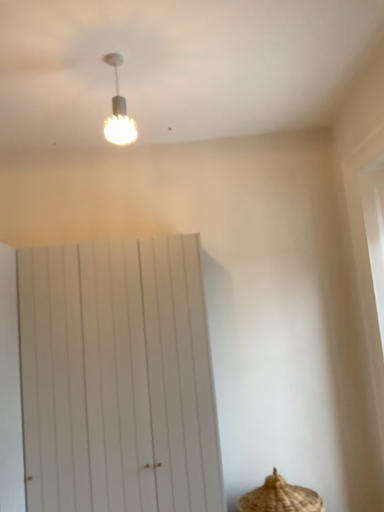
This screenshot has height=512, width=384. Find the location of `white textured bulb at upper center`. white textured bulb at upper center is located at coordinates (118, 111).

This screenshot has height=512, width=384. I want to click on brown woven basket at lower right, so click(x=280, y=497).

Find the location of `white wooden barn door at center`. white wooden barn door at center is located at coordinates (117, 378).

Locate an element on the screen. This screenshot has height=512, width=384. white textured bulb at upper center is located at coordinates (118, 111).

Looking at this image, is white wooden barn door at center with brown woven basket at lower right?

No, white wooden barn door at center is not touching brown woven basket at lower right.

The height and width of the screenshot is (512, 384). I want to click on basket below the white wooden barn door at center (from the image's perspective), so pos(280,497).

Could you tell me if white wooden barn door at center is turned towards brown woven basket at lower right?

No, white wooden barn door at center is not turned towards brown woven basket at lower right.

Considering the points (129, 125) and (181, 265), which point is in front, point (129, 125) or point (181, 265)?

The point (129, 125) is in front.

Is white textured bulb at upper center aimed at white wooden barn door at center?

No, white textured bulb at upper center is not oriented towards white wooden barn door at center.

Considering the positions of objects white textured bulb at upper center and white wooden barn door at center in the image provided, who is more to the right, white textured bulb at upper center or white wooden barn door at center?

From the viewer's perspective, white textured bulb at upper center appears more on the right side.

Is white textured bulb at upper center not within white wooden barn door at center?

Yes, white textured bulb at upper center is located beyond the bounds of white wooden barn door at center.

Can you confirm if brown woven basket at lower right is smaller than white wooden barn door at center?

Indeed, brown woven basket at lower right has a smaller size compared to white wooden barn door at center.

From the image's perspective, relative to white wooden barn door at center, is brown woven basket at lower right above or below?

brown woven basket at lower right is situated lower than white wooden barn door at center in the image.

Is brown woven basket at lower right in contact with white wooden barn door at center?

brown woven basket at lower right and white wooden barn door at center are clearly separated.

Choose the correct answer: Is brown woven basket at lower right inside white wooden barn door at center or outside it?

brown woven basket at lower right is not inside white wooden barn door at center, it's outside.

Can you confirm if white textured bulb at upper center is wider than brown woven basket at lower right?

No, white textured bulb at upper center is not wider than brown woven basket at lower right.

Between point (123, 97) and point (283, 494), which one is positioned in front?

The point (123, 97) is closer to the camera.

From a real-world perspective, which is physically below, white textured bulb at upper center or brown woven basket at lower right?

brown woven basket at lower right, from a real-world perspective.

Is white textured bulb at upper center positioned with its back to brown woven basket at lower right?

white textured bulb at upper center is not turned away from brown woven basket at lower right.

From a real-world perspective, which is physically above, brown woven basket at lower right or white textured bulb at upper center?

From a 3D spatial view, white textured bulb at upper center is above.

Which object is further away from the camera, brown woven basket at lower right or white textured bulb at upper center?

Positioned behind is brown woven basket at lower right.

From the image's perspective, is brown woven basket at lower right under white textured bulb at upper center?

Correct, brown woven basket at lower right appears lower than white textured bulb at upper center in the image.

Can you confirm if brown woven basket at lower right is bigger than white textured bulb at upper center?

Correct, brown woven basket at lower right is larger in size than white textured bulb at upper center.

How much distance is there between white wooden barn door at center and white textured bulb at upper center?

A distance of 4.20 feet exists between white wooden barn door at center and white textured bulb at upper center.

Does point (94, 318) appear closer or farther from the camera than point (135, 126)?

Clearly, point (94, 318) is closer to the camera than point (135, 126).

Which of these two, white wooden barn door at center or white textured bulb at upper center, stands shorter?

Standing shorter between the two is white textured bulb at upper center.

Is white wooden barn door at center in front of or behind white textured bulb at upper center in the image?

Visually, white wooden barn door at center is located behind white textured bulb at upper center.

Find the location of a particular element. barn door that is on the left side of brown woven basket at lower right is located at coordinates (117, 378).

At what (x,y) coordinates should I click in order to perform the action: click on lamp above the white wooden barn door at center (from the image's perspective). Please return your answer as a coordinate pair (x, y). This screenshot has height=512, width=384. Looking at the image, I should click on (118, 111).

Considering their positions, is white wooden barn door at center positioned closer to brown woven basket at lower right than white textured bulb at upper center?

The object closer to brown woven basket at lower right is white wooden barn door at center.

Considering their positions, is white wooden barn door at center positioned closer to white textured bulb at upper center than brown woven basket at lower right?

white wooden barn door at center.

Considering their positions, is white textured bulb at upper center positioned closer to brown woven basket at lower right than white wooden barn door at center?

white wooden barn door at center is closer to brown woven basket at lower right.

Based on their spatial positions, is brown woven basket at lower right or white textured bulb at upper center further from white wooden barn door at center?

Based on the image, white textured bulb at upper center appears to be further to white wooden barn door at center.

When comparing their distances from white textured bulb at upper center, does brown woven basket at lower right or white wooden barn door at center seem further?

brown woven basket at lower right.

Based on their spatial positions, is white textured bulb at upper center or brown woven basket at lower right further from white wooden barn door at center?

Among the two, white textured bulb at upper center is located further to white wooden barn door at center.

At what (x,y) coordinates should I click in order to perform the action: click on barn door between white textured bulb at upper center and brown woven basket at lower right in the up-down direction. Please return your answer as a coordinate pair (x, y). This screenshot has height=512, width=384. Looking at the image, I should click on coord(117,378).